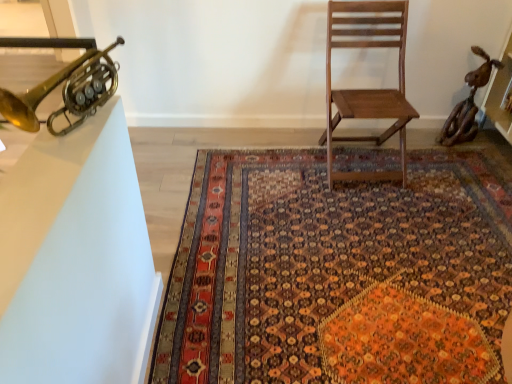
Locate an element on the screen. Image resolution: width=512 pixels, height=384 pixels. vacant point above white glossy table at left (from a real-world perspective) is located at coordinates (47, 169).